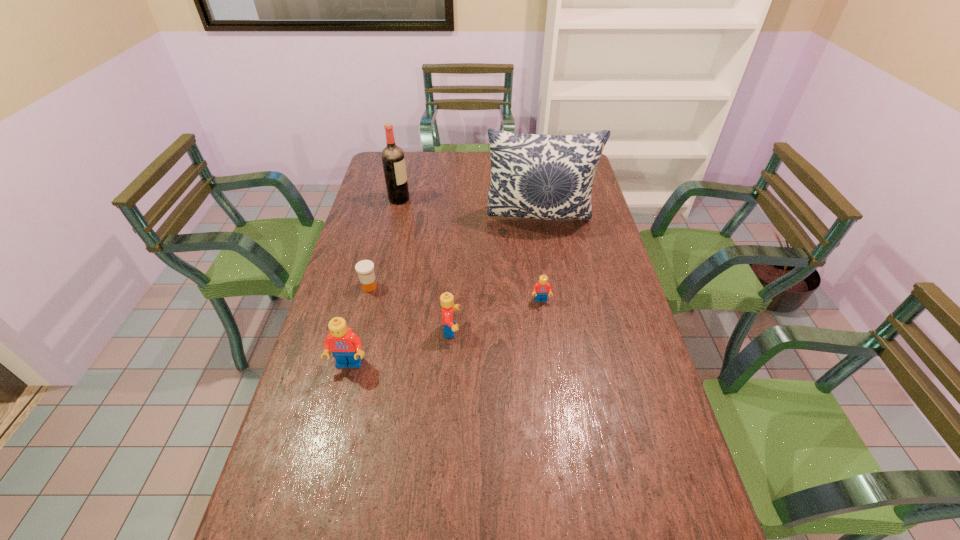
Identify the location of vacant area located 0.270m on the face of the fourth tallest object. (553, 330).

Find the location of a particular element. free space located 0.220m on the face of the third nearest object is located at coordinates (549, 363).

What are the coordinates of `vacant space located 0.130m on the front-facing side of the liquor` in the screenshot? It's located at (443, 199).

At what (x,y) coordinates should I click in order to perform the action: click on vacant space located on the front surface of the cushion. Please return your answer as a coordinate pair (x, y). This screenshot has width=960, height=540. Looking at the image, I should click on (555, 312).

Where is `free location located 0.280m on the label of the medicine`? The height and width of the screenshot is (540, 960). free location located 0.280m on the label of the medicine is located at coordinates (466, 287).

This screenshot has height=540, width=960. I want to click on Lego that is at the left edge, so click(346, 346).

Where is `liquor positioned at the left edge`? liquor positioned at the left edge is located at coordinates (393, 159).

Find the location of a particular element. This screenshot has width=960, height=540. medicine at the left edge is located at coordinates (365, 268).

Where is `object that is positioned at the right edge`? object that is positioned at the right edge is located at coordinates (536, 176).

This screenshot has width=960, height=540. I want to click on vacant space at the far edge of the desktop, so click(x=445, y=169).